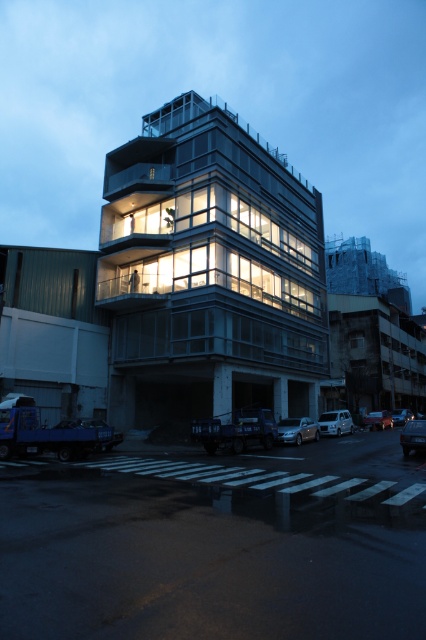
Question: Can you confirm if satin silver sedan at center is positioned above shiny black sedan at center?

Choices:
 (A) yes
 (B) no

Answer: (A)

Question: Is white matte van at lower right wider than shiny black sedan at center?

Choices:
 (A) no
 (B) yes

Answer: (A)

Question: Which is farther from the white matte van at lower right?

Choices:
 (A) shiny black car at lower right
 (B) shiny black sedan at center
 (C) transparent glass building at center
 (D) satin silver sedan at center

Answer: (C)

Question: Can you confirm if white matte van at lower right is positioned to the left of shiny black car at lower right?

Choices:
 (A) yes
 (B) no

Answer: (A)

Question: Which object is the closest to the shiny black car at lower right?

Choices:
 (A) transparent glass building at center
 (B) white matte van at lower right
 (C) shiny black sedan at center

Answer: (C)

Question: Which object appears farthest from the camera in this image?

Choices:
 (A) shiny black sedan at center
 (B) matte black sedan at lower right
 (C) satin silver sedan at center

Answer: (A)